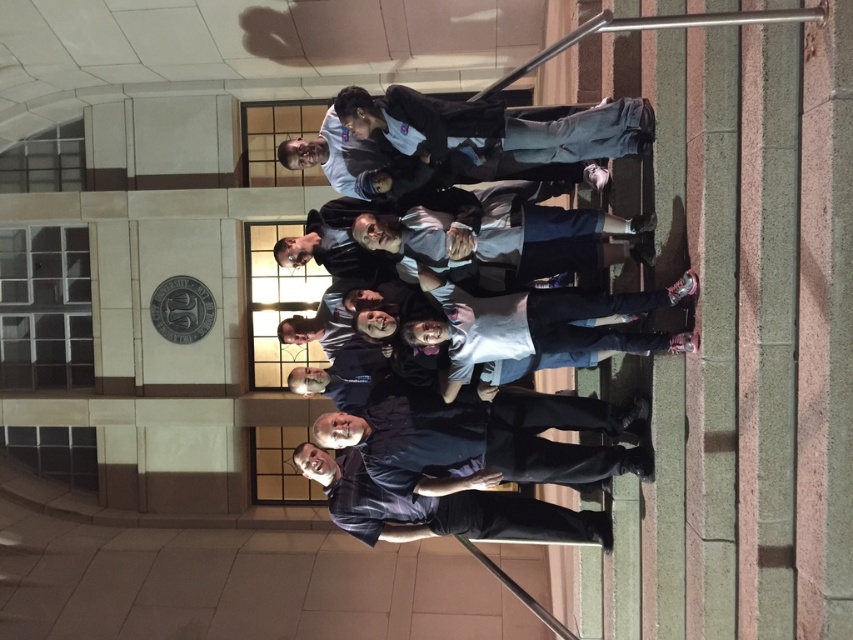
You are organizing a photo shoot and need to ensure that the dark gray uniform at center and the dark blue shirt at center are visible in the frame. Given their sizes, which clothing item might you need to position closer to the camera to ensure both are clearly visible?

The dark gray uniform at center is larger in size than the dark blue shirt at center. To ensure both are clearly visible, you might position the smaller dark blue shirt at center closer to the camera so that its details are not overshadowed by the larger uniform.

You are standing at the base of the stairs leading up to the building with the arched stained glass window. You want to take a photo of a specific point located at coordinates point (471, 252). Given that the distance from your current position to that point is 6.75 meters, can you estimate whether you need to use a telephoto lens to capture the point clearly in your photo?

The distance from your current position to point (471, 252) is 6.75 meters. Since telephoto lenses are typically used for capturing distant subjects clearly, you would need to use a telephoto lens to ensure the point at (471, 252) is captured clearly in your photo.

You are a photographer trying to capture a clear photo of the dark gray uniform at center and the dark blue shirt at lower center. Which person should you focus on first to ensure both are in focus?

You should focus on the dark gray uniform at center first since it is in front of the dark blue shirt at lower center, ensuring both will be in focus when starting with the closer subject.